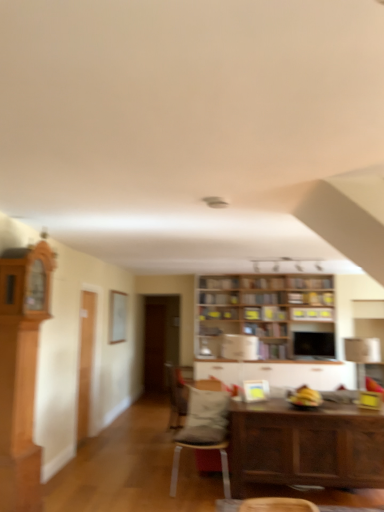
Question: From the image's perspective, is wooden bookshelf at center, which is the second shelf in bottom-to-top order, on wooden table at lower right?

Choices:
 (A) yes
 (B) no

Answer: (A)

Question: Considering the relative sizes of wooden bookshelf at center, the 3th shelf positioned from the top, and wooden table at lower right in the image provided, is wooden bookshelf at center, the 3th shelf positioned from the top, taller than wooden table at lower right?

Choices:
 (A) yes
 (B) no

Answer: (B)

Question: Does wooden bookshelf at center, which is the second shelf in bottom-to-top order, have a lesser width compared to wooden table at lower right?

Choices:
 (A) yes
 (B) no

Answer: (A)

Question: Is wooden bookshelf at center, the 3th shelf positioned from the top, far away from wooden table at lower right?

Choices:
 (A) no
 (B) yes

Answer: (B)

Question: From a real-world perspective, is wooden bookshelf at center, which is the second shelf in bottom-to-top order, located beneath wooden table at lower right?

Choices:
 (A) yes
 (B) no

Answer: (B)

Question: Based on their sizes in the image, would you say wooden shelves at upper center, which is the third shelf in bottom-to-top order, is bigger or smaller than matte gray cushioned chair at center, which is the 1th chair in front-to-back order?

Choices:
 (A) small
 (B) big

Answer: (A)

Question: In the image, is wooden shelves at upper center, which is the 2th shelf from top to bottom, on the left side or the right side of matte gray cushioned chair at center, which is the 1th chair in front-to-back order?

Choices:
 (A) left
 (B) right

Answer: (B)

Question: From a real-world perspective, is wooden shelves at upper center, which is the third shelf in bottom-to-top order, physically located above or below matte gray cushioned chair at center, which is the 1th chair in front-to-back order?

Choices:
 (A) below
 (B) above

Answer: (B)

Question: Is point (296, 309) closer or farther from the camera than point (205, 433)?

Choices:
 (A) closer
 (B) farther

Answer: (B)

Question: Is gray fabric pillow at center inside or outside of wooden bookshelf at center, which is the second shelf in bottom-to-top order?

Choices:
 (A) outside
 (B) inside

Answer: (A)

Question: Based on their sizes in the image, would you say gray fabric pillow at center is bigger or smaller than wooden bookshelf at center, the 3th shelf positioned from the top?

Choices:
 (A) small
 (B) big

Answer: (B)

Question: In the image, is gray fabric pillow at center on the left side or the right side of wooden bookshelf at center, the 3th shelf positioned from the top?

Choices:
 (A) right
 (B) left

Answer: (B)

Question: From a real-world perspective, relative to wooden bookshelf at center, which is the second shelf in bottom-to-top order, is gray fabric pillow at center vertically above or below?

Choices:
 (A) above
 (B) below

Answer: (B)

Question: Is velvet gray chair at center, placed as the second chair when sorted from front to back, in front of or behind light brown wood cabinet at left, the first cabinetry when ordered from top to bottom, in the image?

Choices:
 (A) behind
 (B) front

Answer: (A)

Question: Considering the positions of point tap(177, 393) and point tap(26, 317), is point tap(177, 393) closer or farther from the camera than point tap(26, 317)?

Choices:
 (A) farther
 (B) closer

Answer: (A)